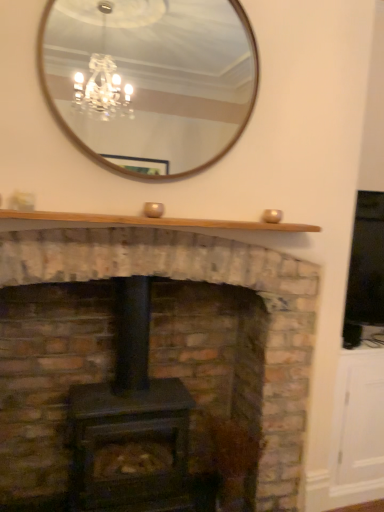
Question: From a real-world perspective, is wooden-framed mirror at upper center on top of natural wood mantle at upper center?

Choices:
 (A) yes
 (B) no

Answer: (A)

Question: Would you say wooden-framed mirror at upper center is a long distance from natural wood mantle at upper center?

Choices:
 (A) yes
 (B) no

Answer: (A)

Question: Does wooden-framed mirror at upper center contain natural wood mantle at upper center?

Choices:
 (A) no
 (B) yes

Answer: (A)

Question: From the image's perspective, would you say wooden-framed mirror at upper center is shown under natural wood mantle at upper center?

Choices:
 (A) no
 (B) yes

Answer: (A)

Question: Considering the relative sizes of wooden-framed mirror at upper center and natural wood mantle at upper center in the image provided, is wooden-framed mirror at upper center bigger than natural wood mantle at upper center?

Choices:
 (A) yes
 (B) no

Answer: (A)

Question: Does wooden-framed mirror at upper center have a lesser height compared to natural wood mantle at upper center?

Choices:
 (A) yes
 (B) no

Answer: (B)

Question: Is natural wood mantle at upper center oriented away from wooden-framed mirror at upper center?

Choices:
 (A) no
 (B) yes

Answer: (A)

Question: Considering the relative sizes of natural wood mantle at upper center and wooden-framed mirror at upper center in the image provided, is natural wood mantle at upper center bigger than wooden-framed mirror at upper center?

Choices:
 (A) no
 (B) yes

Answer: (A)

Question: From the image's perspective, would you say natural wood mantle at upper center is positioned over wooden-framed mirror at upper center?

Choices:
 (A) yes
 (B) no

Answer: (B)

Question: Is natural wood mantle at upper center placed right next to wooden-framed mirror at upper center?

Choices:
 (A) yes
 (B) no

Answer: (B)

Question: Is the depth of natural wood mantle at upper center less than that of wooden-framed mirror at upper center?

Choices:
 (A) no
 (B) yes

Answer: (B)

Question: Is natural wood mantle at upper center further to the viewer compared to wooden-framed mirror at upper center?

Choices:
 (A) no
 (B) yes

Answer: (A)

Question: Considering the relative sizes of matte black wood burning stove at center and natural wood mantle at upper center in the image provided, is matte black wood burning stove at center smaller than natural wood mantle at upper center?

Choices:
 (A) yes
 (B) no

Answer: (B)